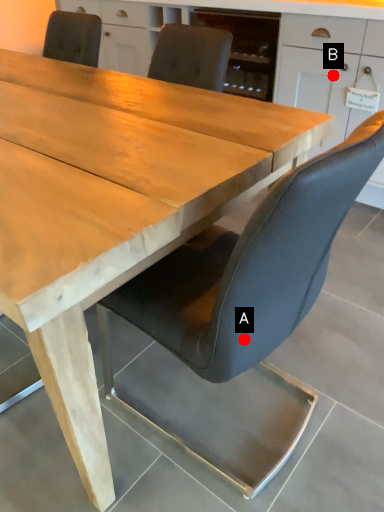
Question: Two points are circled on the image, labeled by A and B beside each circle. Which of the following is the farthest from the observer?

Choices:
 (A) A is further
 (B) B is further

Answer: (B)